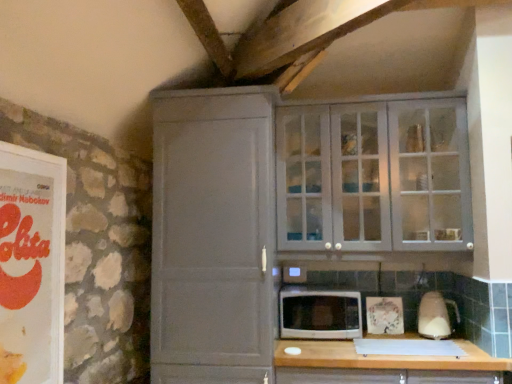
What is the approximate height of matte gray cabinet at upper right, which appears as the 1th cupboard when viewed from the right?

matte gray cabinet at upper right, which appears as the 1th cupboard when viewed from the right, is 36.47 inches tall.

In order to face wooden at lower center, should I rotate leftwards or rightwards?

A 16.373 degree turn to the right will do.

At what (x,y) coordinates should I click in order to perform the action: click on matte gray cabinet at center, which ranks as the first cupboard in left-to-right order. Please return your answer as a coordinate pair (x, y). The height and width of the screenshot is (384, 512). Looking at the image, I should click on coord(213,236).

Starting from the wooden at lower center, which cupboard is the 1st one behind? Please provide its 2D coordinates.

[(213, 236)]

From the image's perspective, which one is positioned lower, wooden at lower center or matte gray cabinet at center, which ranks as the first cupboard in left-to-right order?

From the image's view, wooden at lower center is below.

Would you say wooden at lower center is outside matte gray cabinet at center, which is the 2th cupboard from right to left?

Yes, wooden at lower center is not within matte gray cabinet at center, which is the 2th cupboard from right to left.

Does wooden at lower center turn towards matte gray cabinet at center, which is the 2th cupboard from right to left?

No, wooden at lower center is not aimed at matte gray cabinet at center, which is the 2th cupboard from right to left.

Looking at this image, which is behind, white glossy blender at right or matte orange book at left?

white glossy blender at right is more distant.

Considering the sizes of objects white glossy blender at right and matte orange book at left in the image provided, who is shorter, white glossy blender at right or matte orange book at left?

Standing shorter between the two is white glossy blender at right.

Considering the sizes of objects white glossy blender at right and matte orange book at left in the image provided, who is wider, white glossy blender at right or matte orange book at left?

white glossy blender at right is wider.

Who is smaller, white glossy blender at right or matte orange book at left?

Smaller between the two is white glossy blender at right.

Who is shorter, matte orange book at left or white glossy blender at right?

With less height is white glossy blender at right.

In terms of width, does matte orange book at left look wider or thinner when compared to white glossy blender at right?

In the image, matte orange book at left appears to be more narrow than white glossy blender at right.

In the image, is matte orange book at left positioned in front of or behind white glossy blender at right?

matte orange book at left is in front of white glossy blender at right.

From the image's perspective, which is below, matte orange book at left or white glossy blender at right?

white glossy blender at right is shown below in the image.

Is white glossy blender at right positioned with its back to white glossy microwave at center?

white glossy blender at right is not turned away from white glossy microwave at center.

Locate an element on the screen. This screenshot has width=512, height=384. microwave oven lying behind the white glossy blender at right is located at coordinates (320, 314).

Considering the positions of objects white glossy blender at right and white glossy microwave at center in the image provided, who is more to the right, white glossy blender at right or white glossy microwave at center?

white glossy blender at right.

Does point (420, 315) come in front of point (284, 314)?

That is True.

Can you confirm if wooden at lower center is bigger than white glossy blender at right?

Yes, wooden at lower center is bigger than white glossy blender at right.

Considering the sizes of objects wooden at lower center and white glossy blender at right in the image provided, who is thinner, wooden at lower center or white glossy blender at right?

white glossy blender at right.

From the picture: Who is taller, wooden at lower center or white glossy blender at right?

wooden at lower center is taller.

Which is more to the left, wooden at lower center or matte gray cabinet at upper right, which appears as the second cupboard when viewed from the left?

Positioned to the left is matte gray cabinet at upper right, which appears as the second cupboard when viewed from the left.

From the image's perspective, is wooden at lower center on matte gray cabinet at upper right, which appears as the 1th cupboard when viewed from the right?

Incorrect, from the image's perspective, wooden at lower center is lower than matte gray cabinet at upper right, which appears as the 1th cupboard when viewed from the right.

Would you say wooden at lower center is a long distance from matte gray cabinet at upper right, which appears as the second cupboard when viewed from the left?

No, wooden at lower center is not far away from matte gray cabinet at upper right, which appears as the second cupboard when viewed from the left.

At what (x,y) coordinates should I click in order to perform the action: click on countertop on the right of matte gray cabinet at upper right, which appears as the 1th cupboard when viewed from the right. Please return your answer as a coordinate pair (x, y). This screenshot has width=512, height=384. Looking at the image, I should click on (382, 358).

Looking at this image, which is closer to the camera, (x=37, y=254) or (x=410, y=231)?

Clearly, point (x=37, y=254) is closer to the camera than point (x=410, y=231).

Is matte orange book at left located outside matte gray cabinet at upper right, which appears as the 1th cupboard when viewed from the right?

Absolutely, matte orange book at left is external to matte gray cabinet at upper right, which appears as the 1th cupboard when viewed from the right.

Locate an element on the screen. The width and height of the screenshot is (512, 384). advertisement that is below the matte gray cabinet at upper right, which appears as the 1th cupboard when viewed from the right (from the image's perspective) is located at coordinates (25, 276).

From a real-world perspective, is matte orange book at left positioned above or below matte gray cabinet at upper right, which appears as the 1th cupboard when viewed from the right?

matte orange book at left is below matte gray cabinet at upper right, which appears as the 1th cupboard when viewed from the right.

Find the location of `countertop below the matte gray cabinet at center, which ranks as the first cupboard in left-to-right order (from a real-world perspective)`. countertop below the matte gray cabinet at center, which ranks as the first cupboard in left-to-right order (from a real-world perspective) is located at coordinates (382, 358).

In the image, there is a white glossy blender at right. In order to click on advertisement above it (from the image's perspective) in this screenshot , I will do `click(25, 276)`.

Looking at the image, which one is located closer to matte gray cabinet at center, which ranks as the first cupboard in left-to-right order, matte orange book at left or white glossy blender at right?

The object closer to matte gray cabinet at center, which ranks as the first cupboard in left-to-right order, is matte orange book at left.

Estimate the real-world distances between objects in this image. Which object is further from matte gray cabinet at center, which is the 2th cupboard from right to left, white glossy microwave at center or matte gray cabinet at upper right, which appears as the second cupboard when viewed from the left?

matte gray cabinet at upper right, which appears as the second cupboard when viewed from the left.

From the image, which object appears to be farther from matte gray cabinet at upper right, which appears as the 1th cupboard when viewed from the right, white glossy microwave at center or matte orange book at left?

matte orange book at left lies further to matte gray cabinet at upper right, which appears as the 1th cupboard when viewed from the right, than the other object.

From the image, which object appears to be nearer to white glossy blender at right, matte orange book at left or matte gray cabinet at center, which ranks as the first cupboard in left-to-right order?

matte gray cabinet at center, which ranks as the first cupboard in left-to-right order, is positioned closer to the anchor white glossy blender at right.

From the image, which object appears to be farther from matte gray cabinet at center, which ranks as the first cupboard in left-to-right order, white glossy blender at right or matte orange book at left?

Among the two, white glossy blender at right is located further to matte gray cabinet at center, which ranks as the first cupboard in left-to-right order.

In the scene shown: When comparing their distances from white glossy microwave at center, does matte gray cabinet at upper right, which appears as the second cupboard when viewed from the left, or wooden at lower center seem closer?

wooden at lower center.

Looking at the image, which one is located further to matte orange book at left, white glossy blender at right or matte gray cabinet at center, which is the 2th cupboard from right to left?

The object further to matte orange book at left is white glossy blender at right.

Estimate the real-world distances between objects in this image. Which object is closer to white glossy microwave at center, matte gray cabinet at center, which is the 2th cupboard from right to left, or matte orange book at left?

matte gray cabinet at center, which is the 2th cupboard from right to left, is closer to white glossy microwave at center.

Locate an element on the screen. The width and height of the screenshot is (512, 384). appliance between matte gray cabinet at upper right, which appears as the 1th cupboard when viewed from the right, and wooden at lower center from top to bottom is located at coordinates [435, 316].

You are a GUI agent. You are given a task and a screenshot of the screen. Output one action in this format:
    pyautogui.click(x=<x>, y=<y>)
    Task: Click on the cupboard between matte orange book at left and white glossy microwave at center
    
    Given the screenshot: What is the action you would take?
    pyautogui.click(x=213, y=236)

At what (x,y) coordinates should I click in order to perform the action: click on microwave oven between matte gray cabinet at center, which is the 2th cupboard from right to left, and white glossy blender at right. Please return your answer as a coordinate pair (x, y). The image size is (512, 384). Looking at the image, I should click on (320, 314).

The image size is (512, 384). In order to click on microwave oven situated between matte orange book at left and white glossy blender at right from left to right in this screenshot , I will do `click(320, 314)`.